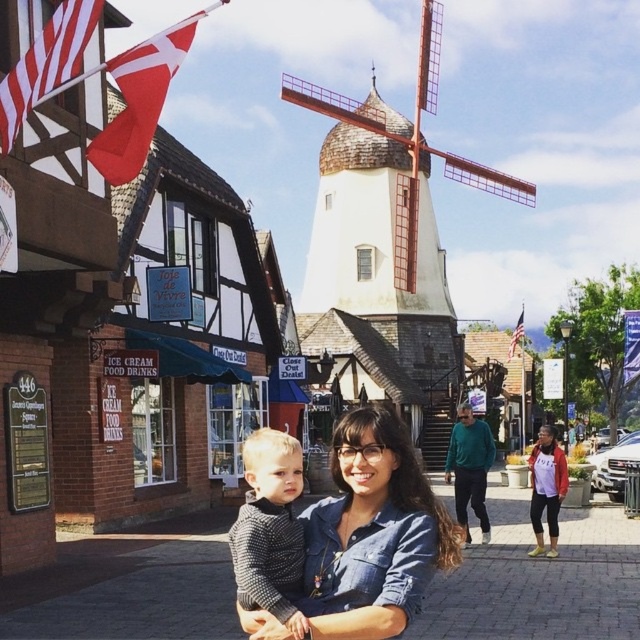
Is denim shirt at center wider than american flag at upper center?

In fact, denim shirt at center might be narrower than american flag at upper center.

Where is `denim shirt at center`? denim shirt at center is located at coordinates (372, 532).

Is point (342, 454) closer to camera compared to point (518, 321)?

That is True.

You are a GUI agent. You are given a task and a screenshot of the screen. Output one action in this format:
    pyautogui.click(x=<x>, y=<y>)
    Task: Click on the denim shirt at center
    The width and height of the screenshot is (640, 640).
    Given the screenshot: What is the action you would take?
    pyautogui.click(x=372, y=532)

Does red and white striped flag at upper left lie in front of american flag at upper center?

That is True.

Who is more distant from viewer, (49,86) or (518,317)?

Positioned behind is point (518,317).

Where is `red and white striped flag at upper left`? Image resolution: width=640 pixels, height=640 pixels. red and white striped flag at upper left is located at coordinates (45, 65).

Does knitted sweater at center have a lesser width compared to red fabric flag at upper left?

Indeed, knitted sweater at center has a lesser width compared to red fabric flag at upper left.

What do you see at coordinates (269, 529) in the screenshot?
I see `knitted sweater at center` at bounding box center [269, 529].

You are a GUI agent. You are given a task and a screenshot of the screen. Output one action in this format:
    pyautogui.click(x=<x>, y=<y>)
    Task: Click on the knitted sweater at center
    The height and width of the screenshot is (640, 640).
    Given the screenshot: What is the action you would take?
    pyautogui.click(x=269, y=529)